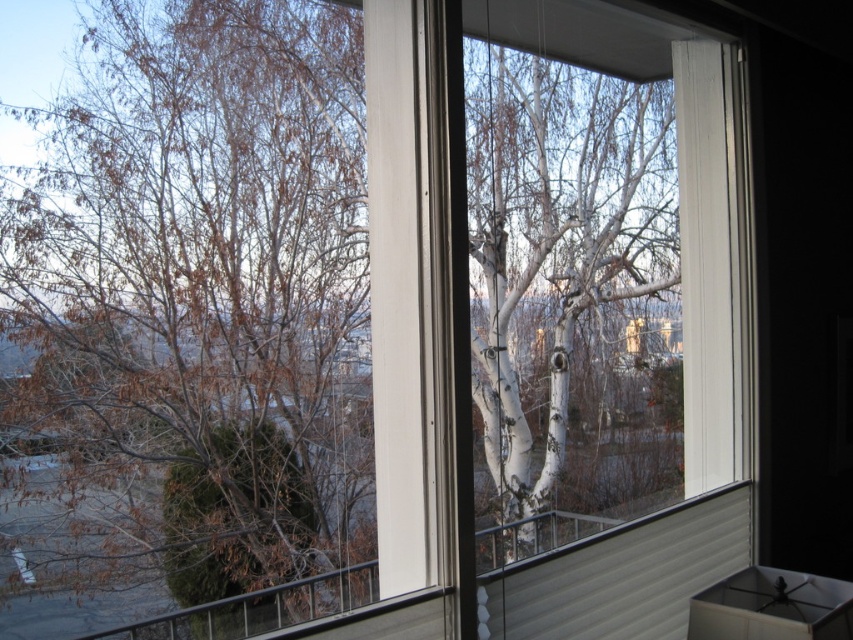
Does point (219, 237) come farther from viewer compared to point (579, 276)?

No, (219, 237) is in front of (579, 276).

Where is `brown/dried bark tree at left`? This screenshot has width=853, height=640. brown/dried bark tree at left is located at coordinates (187, 320).

Identify the location of brown/dried bark tree at left. (187, 320).